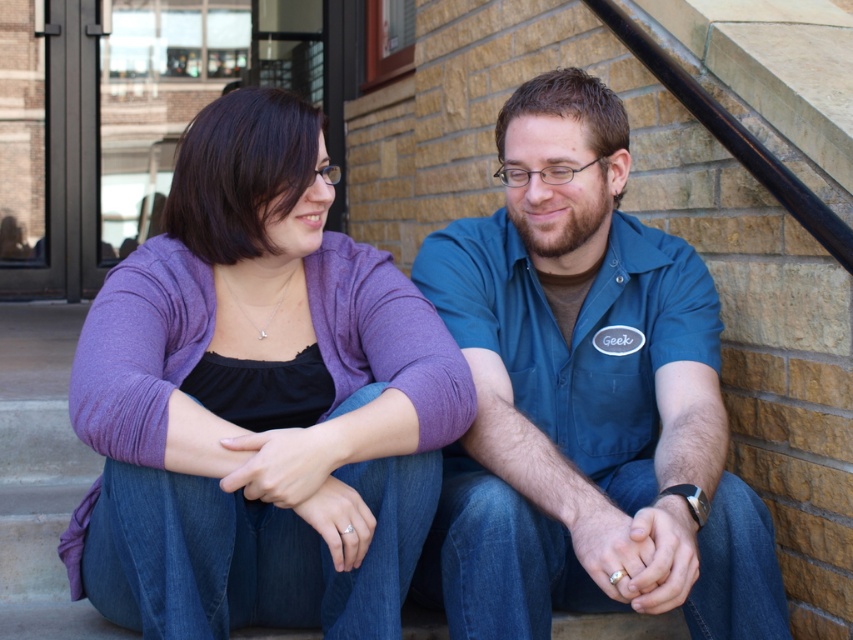
Is purple soft sweater at center in front of blue cotton shirt at center?

Yes, purple soft sweater at center is in front of blue cotton shirt at center.

Describe the element at coordinates (259, 401) in the screenshot. I see `purple soft sweater at center` at that location.

What are the coordinates of `purple soft sweater at center` in the screenshot? It's located at (259, 401).